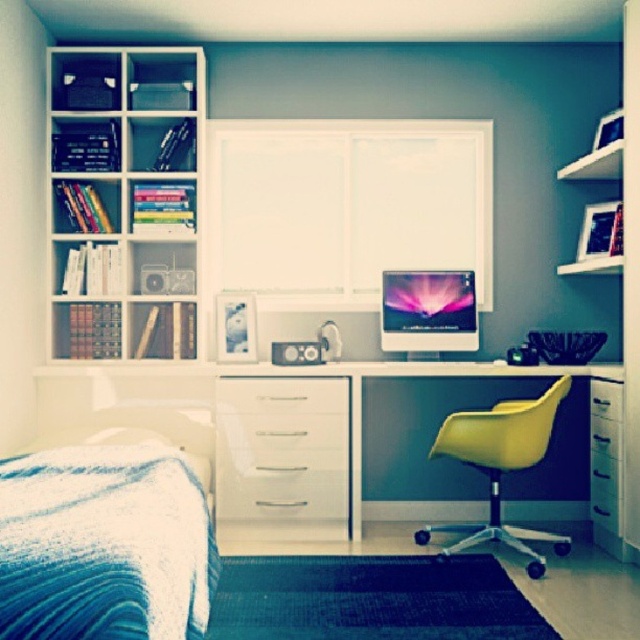
Where is `white glossy desk at center`? This screenshot has height=640, width=640. white glossy desk at center is located at coordinates (253, 378).

Does white glossy desk at center appear under white glossy drawer at center?

No.

Does point (252, 376) lie behind point (218, 422)?

Yes, point (252, 376) is farther from viewer.

The width and height of the screenshot is (640, 640). Find the location of `white glossy desk at center`. white glossy desk at center is located at coordinates (253, 378).

Between point (196, 90) and point (593, 497), which one is positioned in front?

Point (593, 497) is in front.

Does matte white bookshelf at upper left have a smaller size compared to black plastic drawer at right?

No, matte white bookshelf at upper left is not smaller than black plastic drawer at right.

Who is more distant from viewer, (125,246) or (598,442)?

Point (125,246)

Where is `matte white bookshelf at upper left`? matte white bookshelf at upper left is located at coordinates (125, 202).

Is point (10, 477) behind point (435, 289)?

No, it is in front of (435, 289).

Can you confirm if blue textured blanket at lower left is bigger than matte black monitor at center?

Yes, blue textured blanket at lower left is bigger than matte black monitor at center.

The image size is (640, 640). What do you see at coordinates (104, 544) in the screenshot? I see `blue textured blanket at lower left` at bounding box center [104, 544].

At what (x,y) coordinates should I click in order to perform the action: click on blue textured blanket at lower left. Please return your answer as a coordinate pair (x, y). Image resolution: width=640 pixels, height=640 pixels. Looking at the image, I should click on pos(104,544).